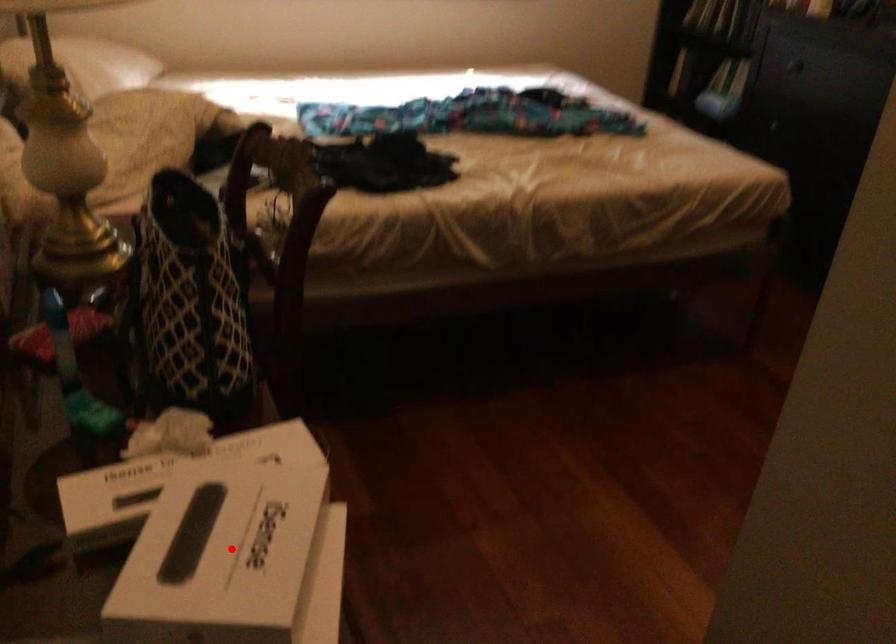
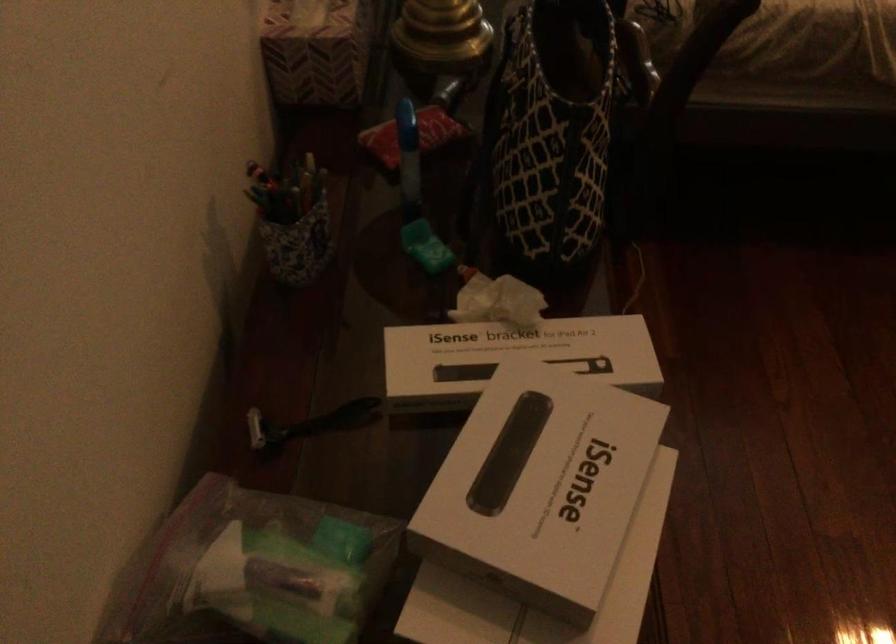
Find the pixel in the second image that matches the highlighted location in the first image.

(540, 486)